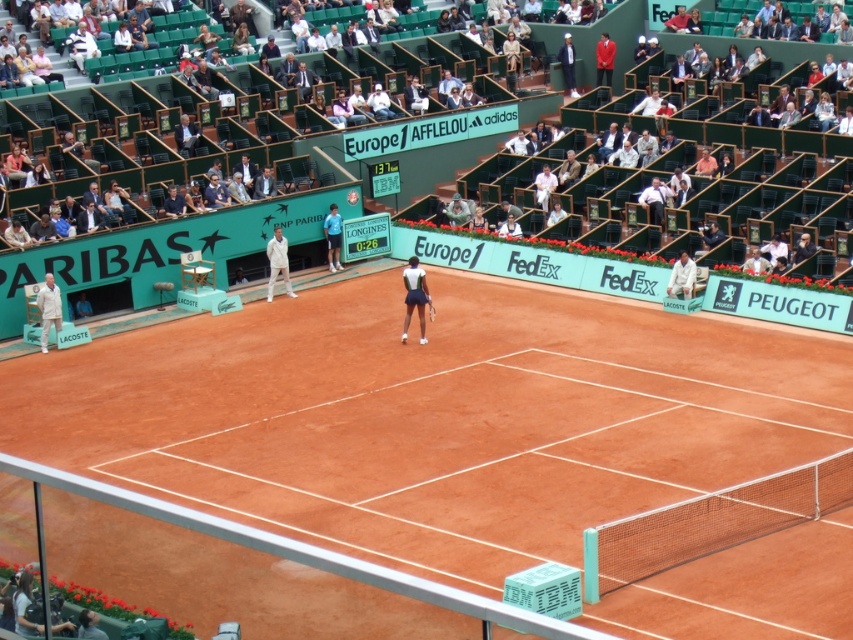
Does brown clay tennis court at center have a smaller size compared to white cotton shirt at upper center?

No.

Can you confirm if brown clay tennis court at center is taller than white cotton shirt at upper center?

Indeed, brown clay tennis court at center has a greater height compared to white cotton shirt at upper center.

Locate an element on the screen. brown clay tennis court at center is located at coordinates (434, 417).

Is point (45, 340) positioned before point (433, 316)?

No, (45, 340) is further to viewer.

Where is `white clothed person at left`? This screenshot has width=853, height=640. white clothed person at left is located at coordinates (48, 308).

Identify the location of white clothed person at left. The width and height of the screenshot is (853, 640). (48, 308).

Looking at this image, does white clothed person at left have a larger size compared to blue fabric shirt at center?

Indeed, white clothed person at left has a larger size compared to blue fabric shirt at center.

Identify the location of white clothed person at left. The width and height of the screenshot is (853, 640). (48, 308).

Between point (61, 300) and point (341, 228), which one is positioned in front?

Point (61, 300)

You are a GUI agent. You are given a task and a screenshot of the screen. Output one action in this format:
    pyautogui.click(x=<x>, y=<y>)
    Task: Click on the white clothed person at left
    The width and height of the screenshot is (853, 640).
    Given the screenshot: What is the action you would take?
    pyautogui.click(x=48, y=308)